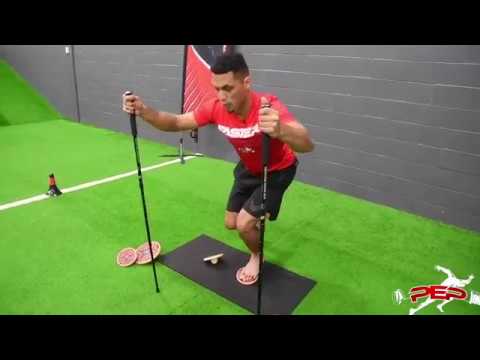
The width and height of the screenshot is (480, 360). Find the location of `wall`. wall is located at coordinates (358, 111).